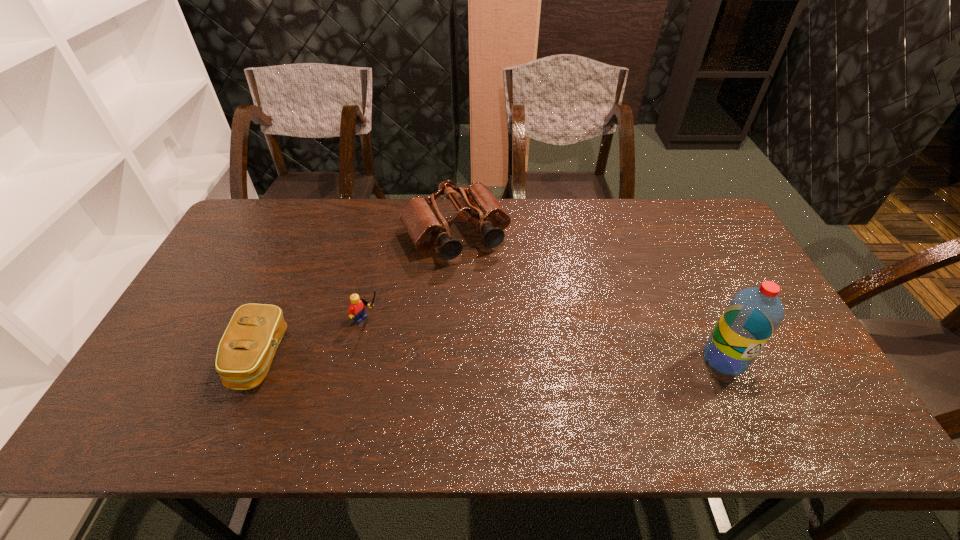
What are the coordinates of `vacant space located on the zipper side of the shortest object` in the screenshot? It's located at (204, 357).

Where is `blank space located through the eyepieces of the farthest object`? Image resolution: width=960 pixels, height=540 pixels. blank space located through the eyepieces of the farthest object is located at coordinates (540, 369).

Image resolution: width=960 pixels, height=540 pixels. In order to click on free spot located 0.110m through the eyepieces of the farthest object in this screenshot , I will do `click(492, 291)`.

The height and width of the screenshot is (540, 960). Find the location of `vacant area located 0.150m through the eyepieces of the farthest object`. vacant area located 0.150m through the eyepieces of the farthest object is located at coordinates (497, 300).

Identify the location of free space located on the front-facing side of the third tallest object. (419, 349).

The width and height of the screenshot is (960, 540). I want to click on free space located on the front-facing side of the third tallest object, so (x=431, y=356).

The image size is (960, 540). Identify the location of free space located 0.050m on the front-facing side of the third tallest object. [394, 332].

You are a GUI agent. You are given a task and a screenshot of the screen. Output one action in this format:
    pyautogui.click(x=<x>, y=<y>)
    Task: Click on the object located in the far edge section of the desktop
    The width and height of the screenshot is (960, 540).
    Given the screenshot: What is the action you would take?
    pyautogui.click(x=426, y=226)

In order to click on clutch bag that is at the near edge in this screenshot , I will do (246, 350).

Identify the location of water bottle that is at the near edge. Image resolution: width=960 pixels, height=540 pixels. (752, 316).